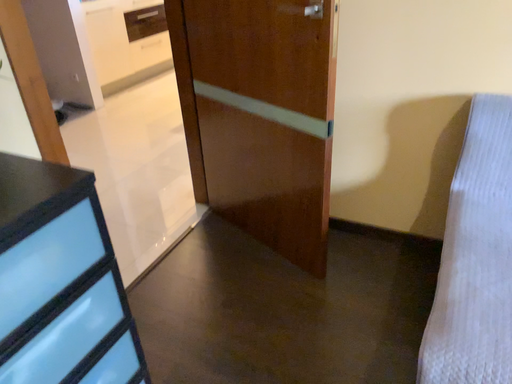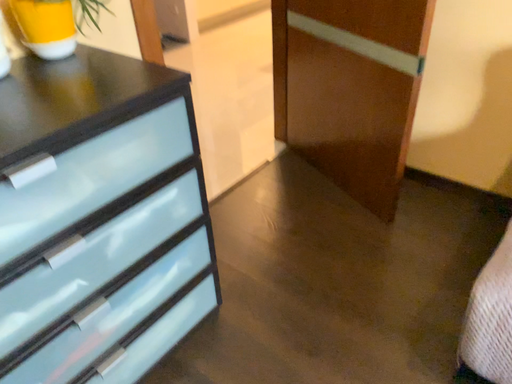
Question: How did the camera likely rotate when shooting the video?

Choices:
 (A) rotated left
 (B) rotated right

Answer: (A)